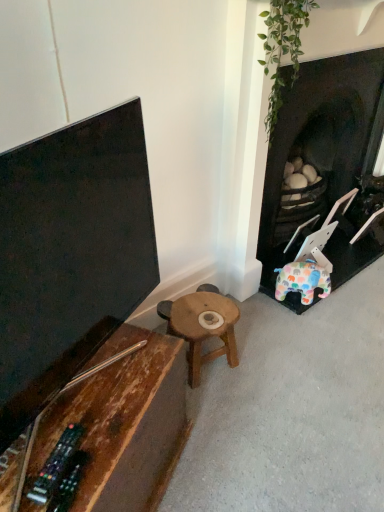
This screenshot has height=512, width=384. I want to click on free space above wooden stool at center, the 1th table viewed from the back (from a real-world perspective), so click(201, 312).